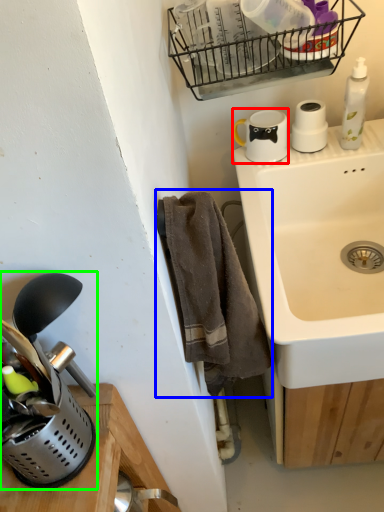
Question: Which object is the closest to the appliance (highlighted by a red box)? Choose among these: bath towel (highlighted by a blue box) or appliance (highlighted by a green box).

Choices:
 (A) bath towel
 (B) appliance

Answer: (A)